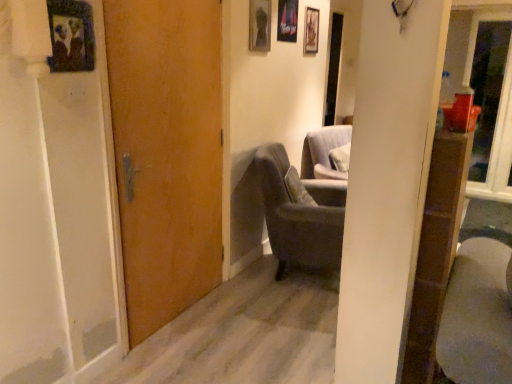
Question: Is wooden picture frame at upper center, which is the fourth picture frame from left to right, further to the viewer compared to dark gray fabric chair at center?

Choices:
 (A) no
 (B) yes

Answer: (B)

Question: Is wooden picture frame at upper center, the fourth picture frame when ordered from front to back, turned away from dark gray fabric chair at center?

Choices:
 (A) yes
 (B) no

Answer: (B)

Question: From a real-world perspective, is wooden picture frame at upper center, positioned as the first picture frame in right-to-left order, beneath dark gray fabric chair at center?

Choices:
 (A) no
 (B) yes

Answer: (A)

Question: Considering the relative sizes of wooden picture frame at upper center, the 1th picture frame viewed from the back, and dark gray fabric chair at center in the image provided, is wooden picture frame at upper center, the 1th picture frame viewed from the back, bigger than dark gray fabric chair at center?

Choices:
 (A) yes
 (B) no

Answer: (B)

Question: From the image's perspective, is wooden picture frame at upper center, positioned as the first picture frame in right-to-left order, below dark gray fabric chair at center?

Choices:
 (A) no
 (B) yes

Answer: (A)

Question: Is wooden picture frame at upper center, positioned as the first picture frame in right-to-left order, beside dark gray fabric chair at center?

Choices:
 (A) yes
 (B) no

Answer: (B)

Question: Is wooden picture frame at upper center, positioned as the first picture frame in right-to-left order, completely or partially outside of wooden door at center?

Choices:
 (A) yes
 (B) no

Answer: (A)

Question: From the image's perspective, would you say wooden picture frame at upper center, which is the fourth picture frame from left to right, is shown under wooden door at center?

Choices:
 (A) no
 (B) yes

Answer: (A)

Question: Is wooden picture frame at upper center, which is the fourth picture frame from left to right, smaller than wooden door at center?

Choices:
 (A) yes
 (B) no

Answer: (A)

Question: From a real-world perspective, is wooden picture frame at upper center, the fourth picture frame when ordered from front to back, over wooden door at center?

Choices:
 (A) no
 (B) yes

Answer: (B)

Question: Is wooden picture frame at upper center, positioned as the first picture frame in right-to-left order, touching wooden door at center?

Choices:
 (A) no
 (B) yes

Answer: (A)

Question: From the image's perspective, is transparent glass door at upper right below dark gray fabric chair at center?

Choices:
 (A) no
 (B) yes

Answer: (A)